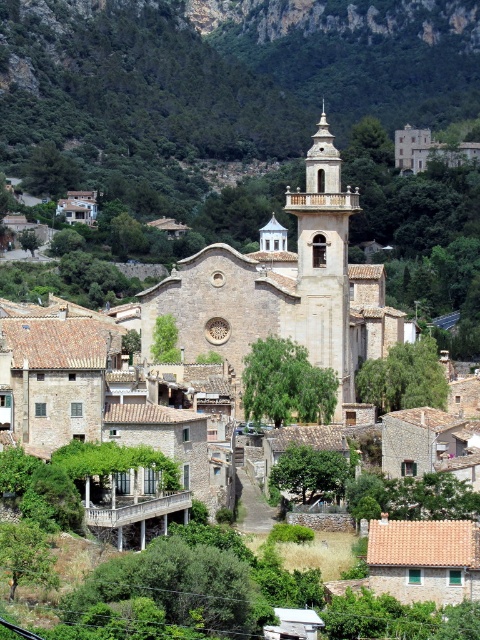
You are a tourist standing in the village square and want to take a photo of the light beige stone church at center. However, there is a green leafy mountain at upper center in the way. Can you still see the church in your photo?

The light beige stone church at center is behind the green leafy mountain at upper center, so it might be partially or fully obstructed in your photo.

You are a tourist standing in the village square and want to take a photo of the green leafy mountain at upper center and the light beige stone church at center. Which object should you frame first in your camera to ensure both are in the shot?

You should frame the light beige stone church at center first because the green leafy mountain at upper center is positioned to the left of it, so centering the church will allow the mountain to be included on the left side of the frame.

You are an architect visiting this village and want to take a photo of the light beige stone church at center without any obstructions. Is the green leafy mountain at upper center blocking the view of the church?

The green leafy mountain at upper center is above the light beige stone church at center, so it is blocking the view of the church, making it impossible to take a clear photo without obstruction.